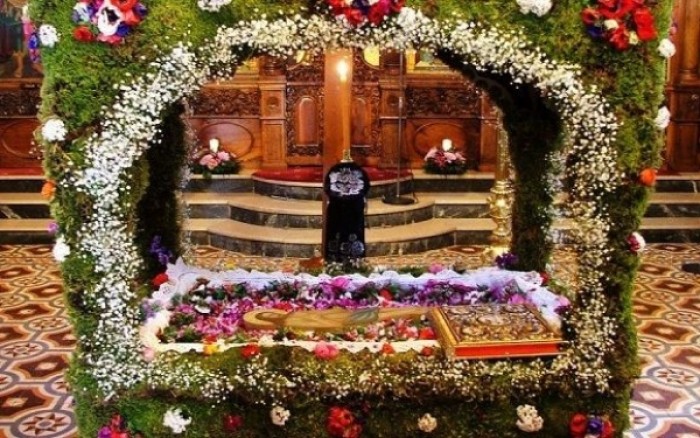
This screenshot has height=438, width=700. In order to click on light reflections on floor in this screenshot , I will do `click(663, 403)`.